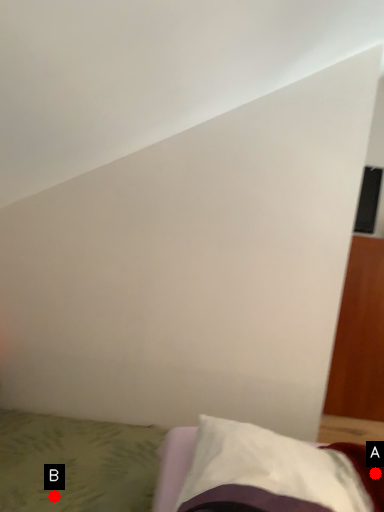
Question: Two points are circled on the image, labeled by A and B beside each circle. Which point appears farthest from the camera in this image?

Choices:
 (A) A is further
 (B) B is further

Answer: (B)